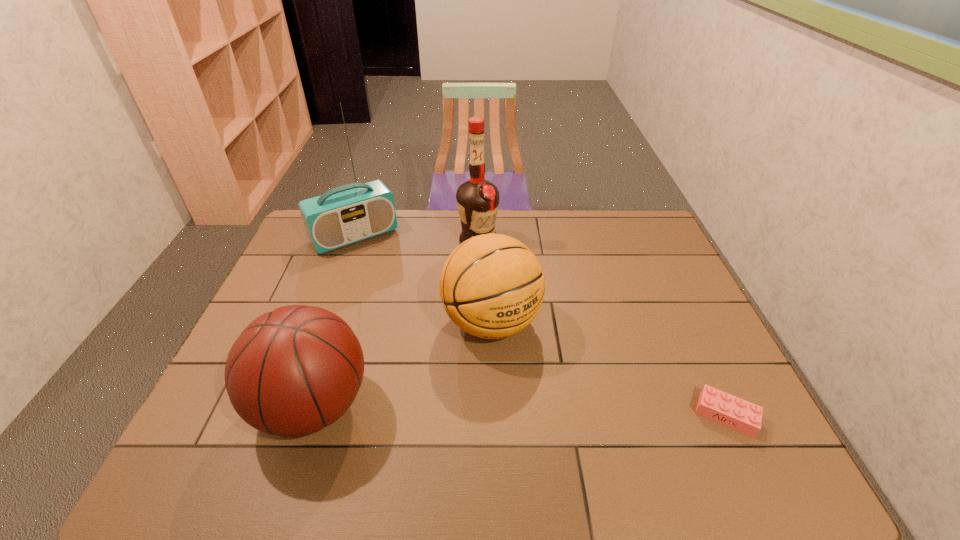
This screenshot has width=960, height=540. What are the coordinates of `free space at the far right corner of the desktop` in the screenshot? It's located at (632, 233).

I want to click on vacant region at the near right corner, so click(709, 426).

Identify the location of vacant space in between the liquor and the radio receiver. (417, 239).

Identify the location of free space between the left basketball and the liquor. (396, 323).

You are a GUI agent. You are given a task and a screenshot of the screen. Output one action in this format:
    pyautogui.click(x=<x>, y=<y>)
    Task: Click on the vacant area between the right basketball and the radio receiver
    
    Given the screenshot: What is the action you would take?
    pyautogui.click(x=423, y=279)

The height and width of the screenshot is (540, 960). In order to click on blank region between the left basketball and the Lego in this screenshot , I will do `click(519, 410)`.

The width and height of the screenshot is (960, 540). Find the location of `vacant space in between the radio receiver and the Lego`. vacant space in between the radio receiver and the Lego is located at coordinates (540, 325).

This screenshot has height=540, width=960. In order to click on vacant region between the radio receiver and the liquor in this screenshot , I will do `click(417, 239)`.

Locate an element on the screen. The height and width of the screenshot is (540, 960). vacant point located between the left basketball and the right basketball is located at coordinates (402, 364).

At what (x,y) coordinates should I click in order to perform the action: click on object that stands as the third closest to the liquor. Please return your answer as a coordinate pair (x, y). The image size is (960, 540). Looking at the image, I should click on (293, 371).